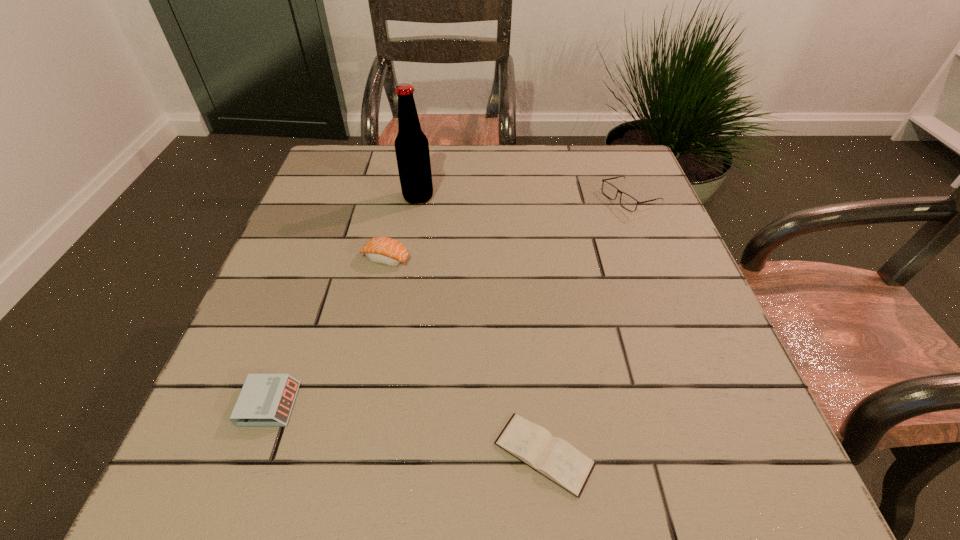
Find the location of a particular element. beer bottle is located at coordinates (411, 145).

Find the location of a particular element. The height and width of the screenshot is (540, 960). the rightmost object is located at coordinates (629, 203).

The image size is (960, 540). Identify the location of the third nearest object. (382, 250).

Identify the location of the leftmost object. (266, 400).

Where is `alarm clock`? This screenshot has height=540, width=960. alarm clock is located at coordinates (266, 400).

In order to click on the fourth object from left to right in this screenshot , I will do coord(553,457).

I want to click on diary, so pos(553,457).

Locate an element on the screen. This screenshot has height=540, width=960. vacant space located on the left of the beer bottle is located at coordinates 364,197.

In order to click on free point located 0.210m with the lenses facing outward on the spectacles in this screenshot , I will do `click(520, 200)`.

Where is `free spot located 0.150m with the lenses facing outward on the spectacles`? free spot located 0.150m with the lenses facing outward on the spectacles is located at coordinates (544, 200).